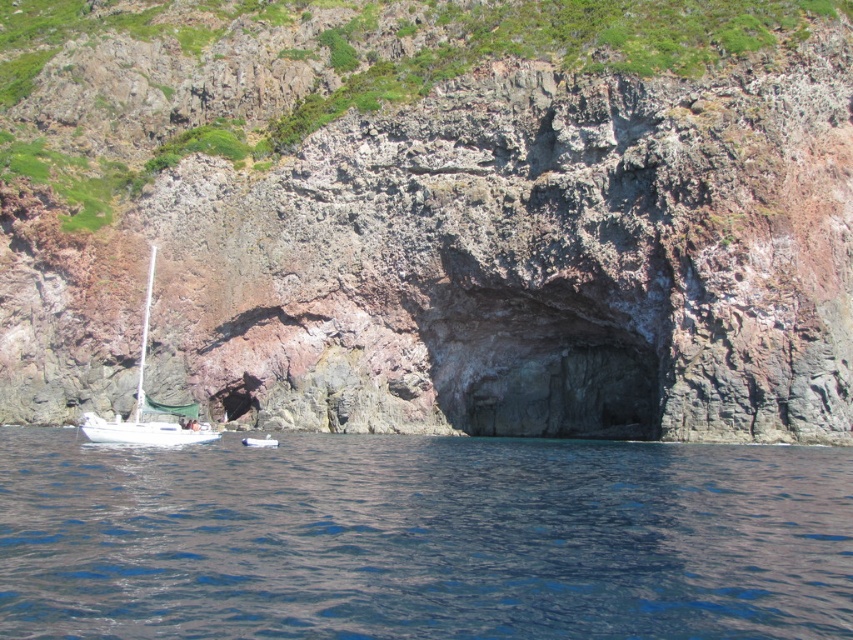
Does rusty rock cliff at center have a greater width compared to white matte sailboat at lower left?

Yes.

Between point (743, 356) and point (163, 435), which one is positioned behind?

The point (743, 356) is more distant.

Where is `rusty rock cliff at center`? The width and height of the screenshot is (853, 640). rusty rock cliff at center is located at coordinates coord(432,212).

How distant is rusty rock cliff at center from blue water at lower left?

rusty rock cliff at center is 28.15 meters from blue water at lower left.

Is rusty rock cliff at center further to the viewer compared to blue water at lower left?

Yes, it is behind blue water at lower left.

Is point (177, 29) positioned in front of point (643, 608)?

No, it is behind (643, 608).

The height and width of the screenshot is (640, 853). Identify the location of rusty rock cliff at center. (432, 212).

Is point (521, 474) positioned after point (97, 428)?

No, it is in front of (97, 428).

Who is higher up, blue water at lower left or white matte sailboat at lower left?

white matte sailboat at lower left is higher up.

What are the coordinates of `blue water at lower left` in the screenshot? It's located at (422, 538).